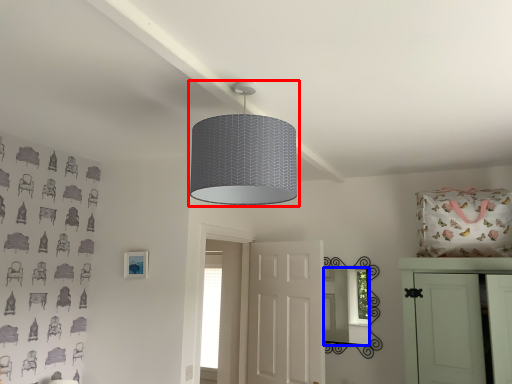
Question: Which of the following is the closest to the observer, lamp (highlighted by a red box) or mirror (highlighted by a blue box)?

Choices:
 (A) lamp
 (B) mirror

Answer: (A)